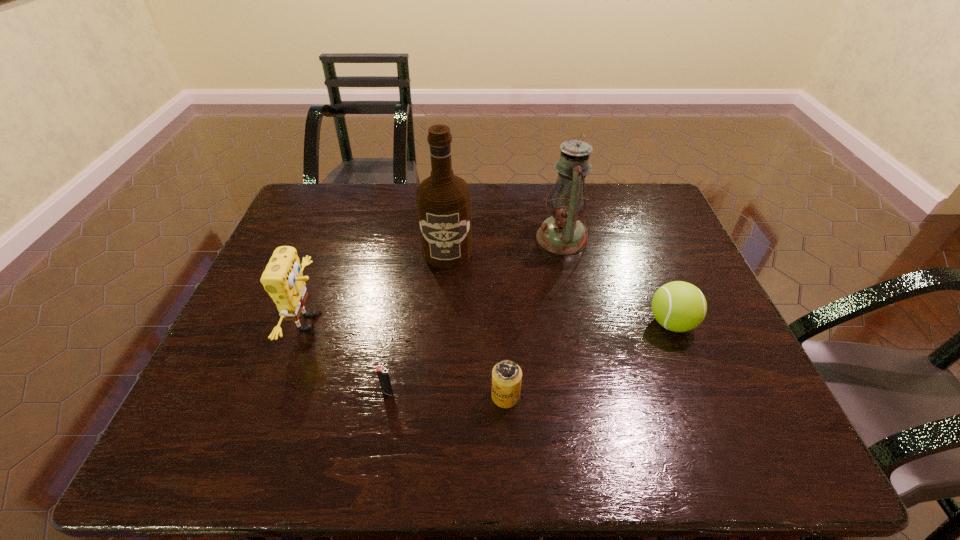
Locate an element on the screen. This screenshot has height=540, width=960. free space located 0.130m on the face of the fourth shortest object is located at coordinates (377, 322).

The image size is (960, 540). I want to click on free space located on the back of the tennis ball, so click(631, 224).

Where is `vacant space located on the right of the third object from right to left`? The image size is (960, 540). vacant space located on the right of the third object from right to left is located at coordinates (690, 396).

Image resolution: width=960 pixels, height=540 pixels. What are the coordinates of `vacant space located 0.310m on the back of the shortest object` in the screenshot? It's located at (405, 286).

Locate an element on the screen. The height and width of the screenshot is (540, 960). object that is at the far edge is located at coordinates (562, 233).

In order to click on object present at the left edge in this screenshot , I will do 283,279.

Identify the location of object positioned at the right edge. The width and height of the screenshot is (960, 540). (678, 306).

At what (x,y) coordinates should I click in order to perform the action: click on vacant region at the far edge. Please return your answer as a coordinate pair (x, y). This screenshot has width=960, height=540. Looking at the image, I should click on (379, 211).

Identify the location of vacant area at the near edge. The width and height of the screenshot is (960, 540). (610, 450).

Locate an element on the screen. The height and width of the screenshot is (540, 960). free space at the left edge is located at coordinates (222, 394).